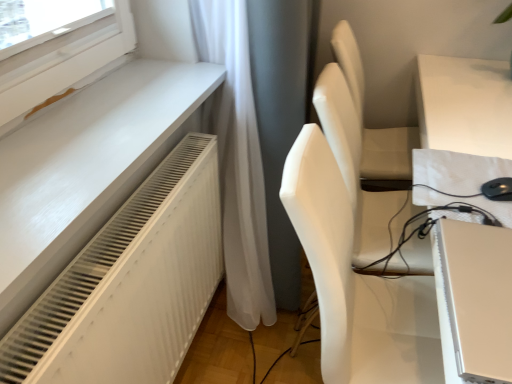
Question: In terms of width, does white matte chair at center look wider or thinner when compared to matte white table at right?

Choices:
 (A) wide
 (B) thin

Answer: (B)

Question: From a real-world perspective, is white matte chair at center positioned above or below matte white table at right?

Choices:
 (A) above
 (B) below

Answer: (A)

Question: Which object is the farthest from the satin gold laptop at lower right?

Choices:
 (A) white matte chair at center
 (B) matte white table at right
 (C) white textured radiator at lower left

Answer: (C)

Question: Estimate the real-world distances between objects in this image. Which object is closer to the white textured radiator at lower left?

Choices:
 (A) satin gold laptop at lower right
 (B) white matte chair at center
 (C) matte white table at right

Answer: (B)